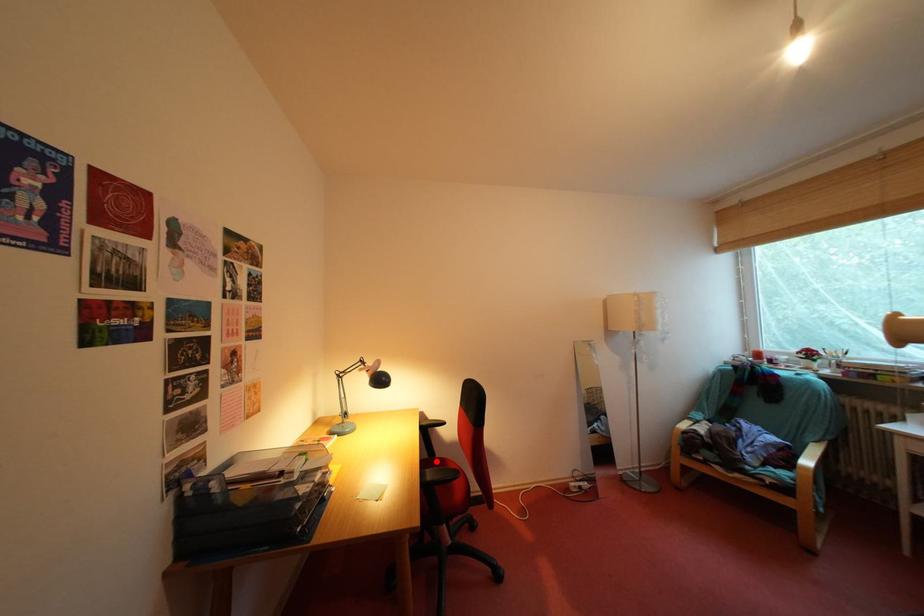
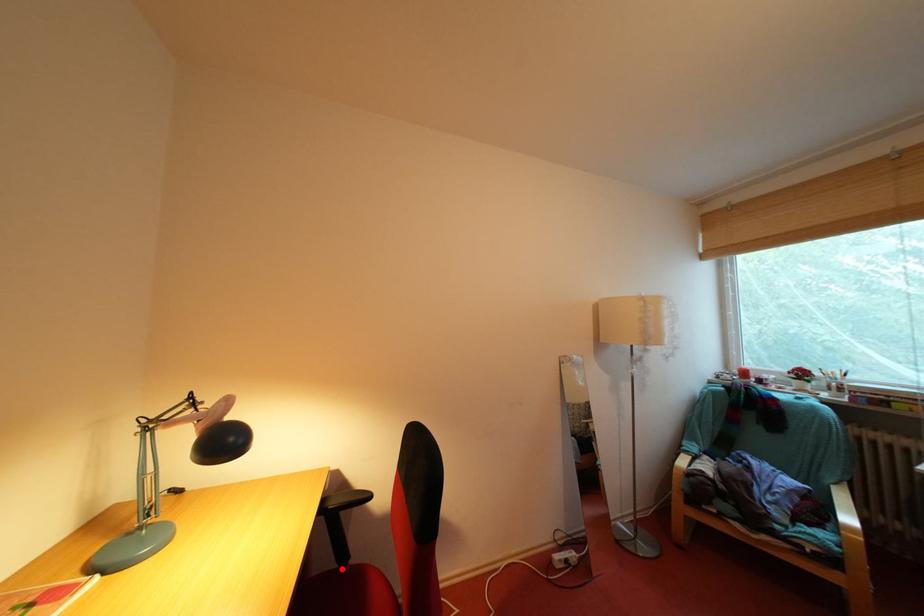
I am providing you with two images of the same scene from different viewpoints. A red point is marked on the first image and another point is marked on the second image. Does the point marked in image1 correspond to the same location as the one in image2?

Yes